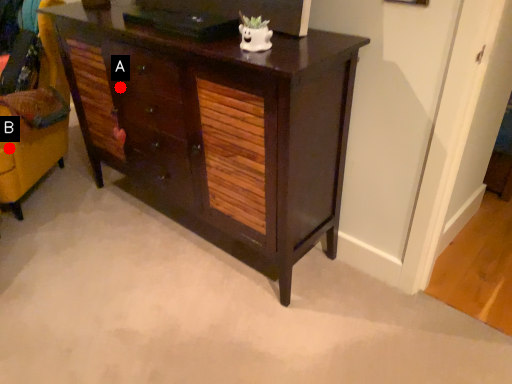
Question: Two points are circled on the image, labeled by A and B beside each circle. Which point is closer to the camera?

Choices:
 (A) A is closer
 (B) B is closer

Answer: (A)